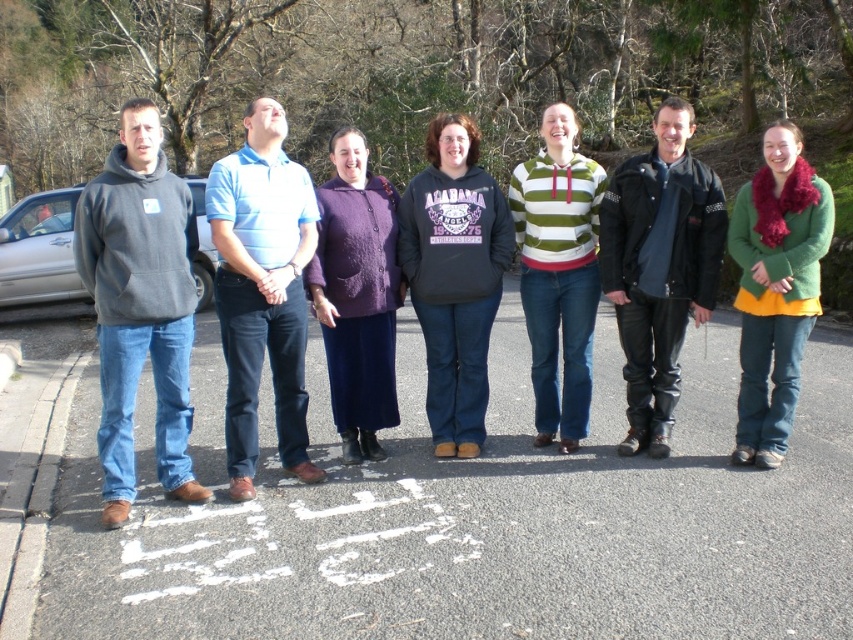
You are standing in front of the group of seven people in the image. There are two points marked on the ground in front of them. One is at coordinates point (151, 132) and the other is at point (292, 400). Which point is closer to you?

Point (151, 132) is closer to the viewer than point (292, 400).

You are a photographer trying to capture a group photo of the dark gray hoodie at center and the striped knitwear at center. If you want to ensure both subjects are fully visible in the frame, which subject should you position closer to the camera to avoid cropping?

You should position the dark gray hoodie at center closer to the camera because its width is larger than the striped knitwear at center, ensuring it fits within the frame without cropping.

You are standing at the origin point of the coordinate system. You see a point marked at coordinate (454, 276). Which object is located at that coordinate?

The point at coordinate (454, 276) marks the location of the dark gray hoodie at center.